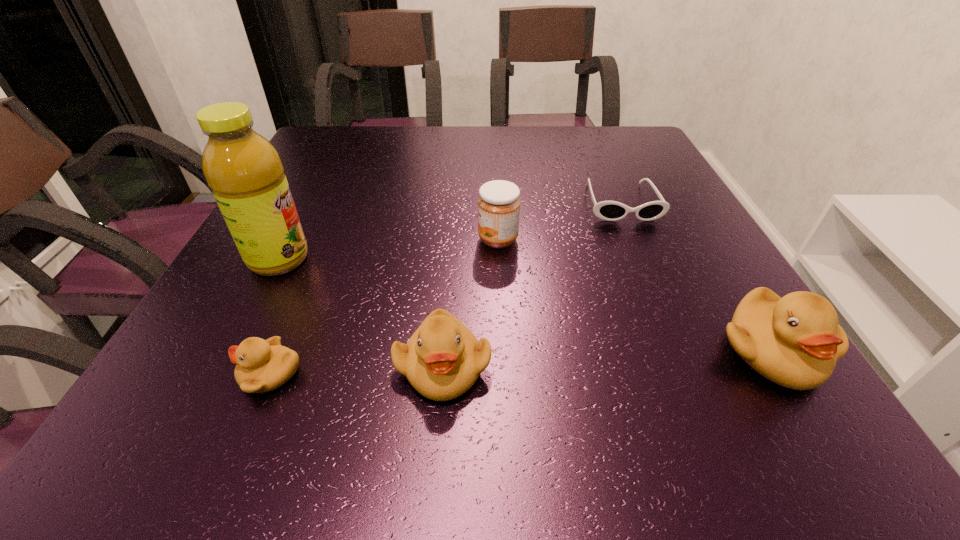
Identify the location of vacant space that is in between the tallest object and the second duckling from left to right. (361, 313).

Locate an element on the screen. vacant space that is in between the farthest object and the jam is located at coordinates (560, 221).

Identify the location of free point between the leftmost duckling and the second duckling from right to left. (357, 370).

Identify the location of vacant point located between the rightmost duckling and the fruit juice. Image resolution: width=960 pixels, height=540 pixels. (525, 306).

Locate an element on the screen. Image resolution: width=960 pixels, height=540 pixels. blank region between the shortest duckling and the rightmost duckling is located at coordinates (521, 363).

What are the coordinates of `free space that is in between the shortest duckling and the second duckling from left to right` in the screenshot? It's located at (357, 370).

Where is `blank region between the rightmost duckling and the second shortest duckling`? The height and width of the screenshot is (540, 960). blank region between the rightmost duckling and the second shortest duckling is located at coordinates (607, 359).

Find the location of a particular element. Image resolution: width=960 pixels, height=540 pixels. vacant area that lies between the tallest object and the farthest object is located at coordinates (450, 231).

Choose which object is the fifth nearest neighbor to the rightmost duckling. Please provide its 2D coordinates. Your answer should be formatted as a tuple, i.e. [(x, y)], where the tuple contains the x and y coordinates of a point satisfying the conditions above.

[(246, 175)]

Image resolution: width=960 pixels, height=540 pixels. In order to click on object that stands as the second closest to the second duckling from right to left in this screenshot , I will do `click(499, 203)`.